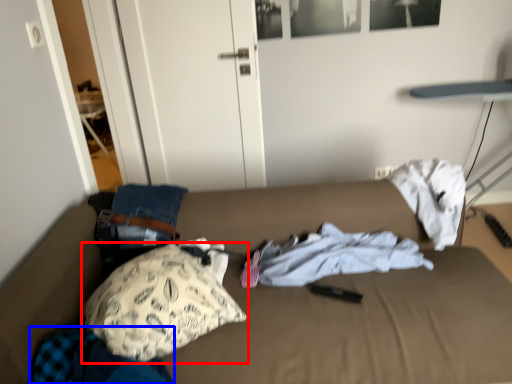
Question: Which point is further to the camera, pillow (highlighted by a red box) or clothing (highlighted by a blue box)?

Choices:
 (A) pillow
 (B) clothing

Answer: (A)